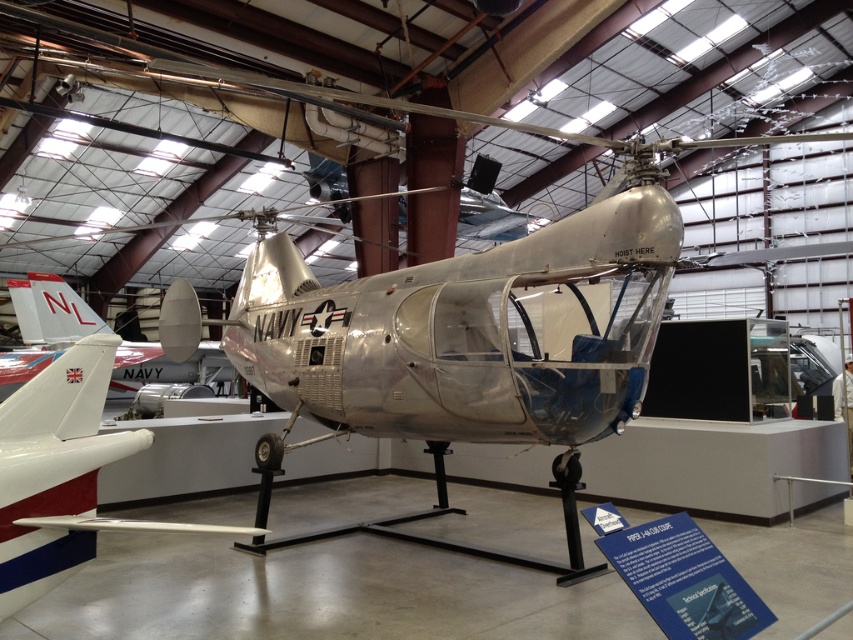
You are standing at the entrance of the museum and see two points marked on the floor near the helicopter. The first point is labeled as point (146,435) and the second as point (148,346). Which point is closer to you when facing the helicopter?

Point (146,435) is closer to you because it is in front of point (148,346) when facing the helicopter.